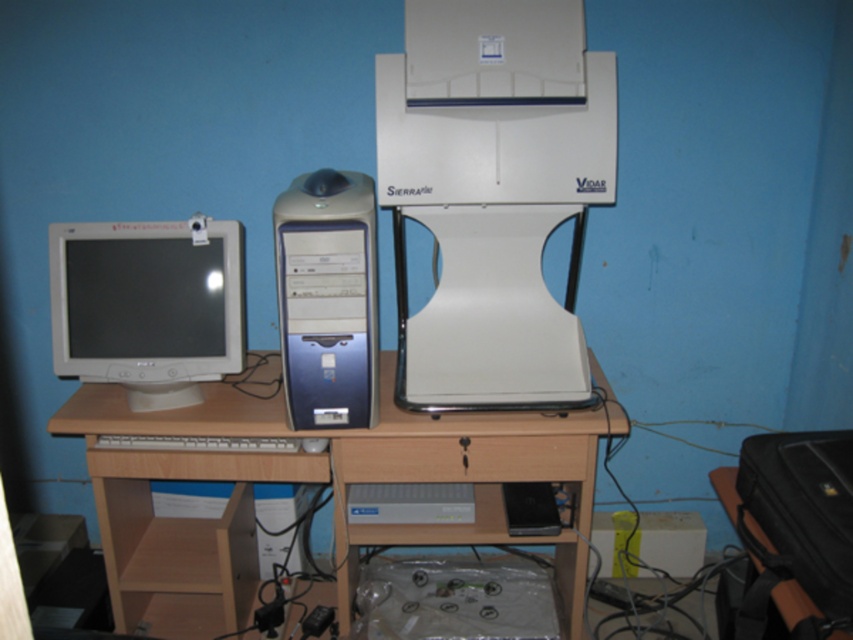
You are organizing your desk and need to place a new item between the wooden at center and the white plastic keyboard at center. Which object should you place the item next to if you want it to be closer to the larger object?

You should place the item next to the wooden at center because it is larger than the white plastic keyboard at center, so it will be closer to the larger object.